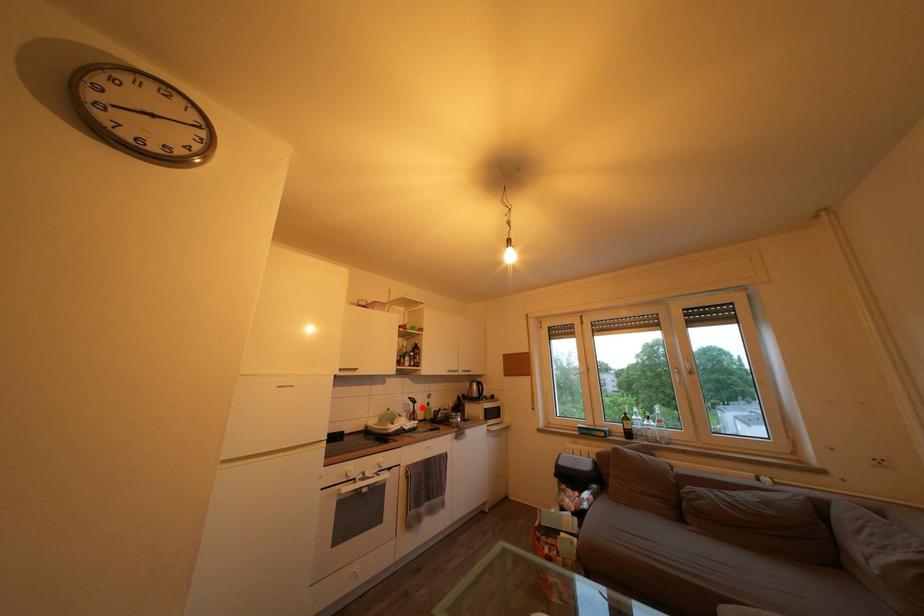
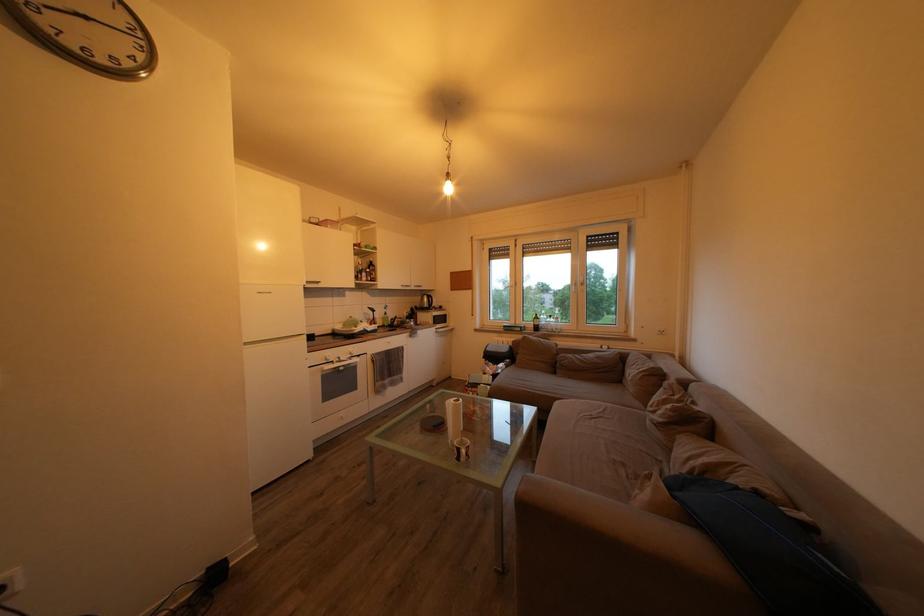
Question: I am providing you with two images of the same scene from different viewpoints. A red point is shown in image1. For the corresponding object point in image2, is it positioned nearer or farther from the camera?

Choices:
 (A) Nearer
 (B) Farther

Answer: (A)